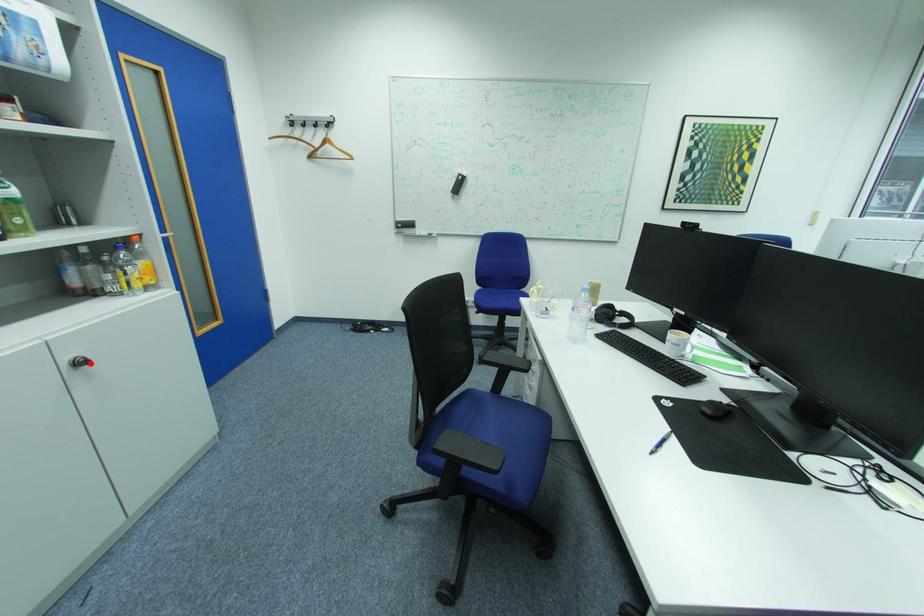
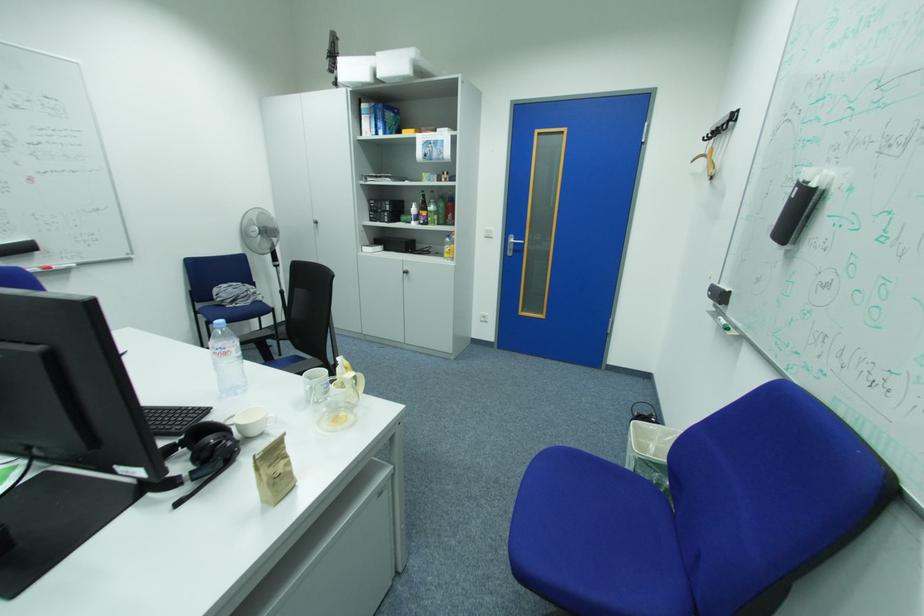
Find the pixel in the second image that matches the highlighted location in the first image.

(415, 273)